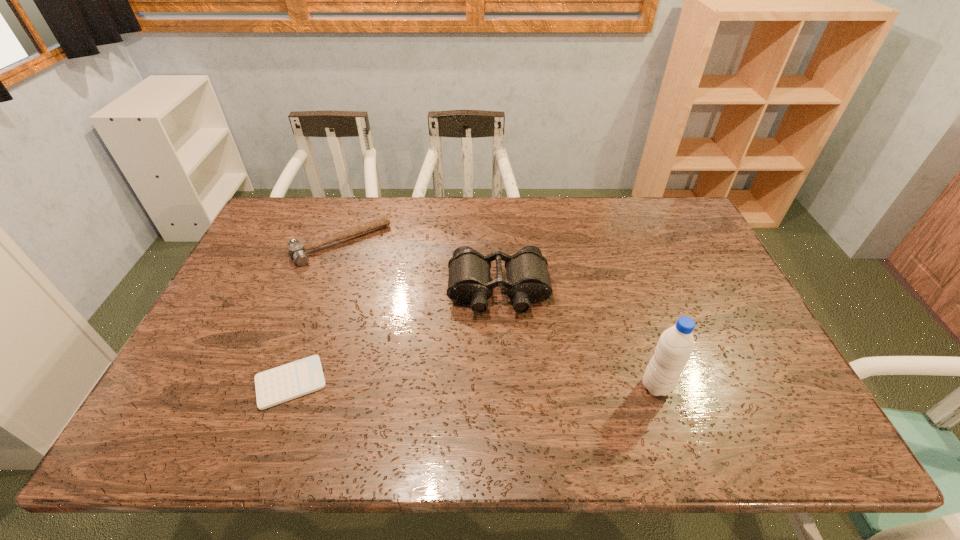
Locate an element on the screen. vacant space that satisfies the following two spatial constraints: 1. on the front side of the third object from left to right; 2. on the left side of the water bottle is located at coordinates (502, 386).